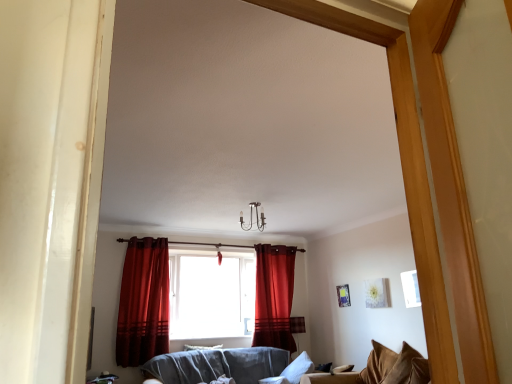
Question: From the image's perspective, is velvet gray couch at center located beneath velvet red curtain at center, which is counted as the 2th curtain, starting from the front?

Choices:
 (A) no
 (B) yes

Answer: (B)

Question: Is velvet gray couch at center further to the viewer compared to velvet red curtain at center, the first curtain when ordered from back to front?

Choices:
 (A) no
 (B) yes

Answer: (A)

Question: From the image's perspective, is velvet gray couch at center over velvet red curtain at center, which appears as the first curtain when viewed from the right?

Choices:
 (A) no
 (B) yes

Answer: (A)

Question: From a real-world perspective, is velvet gray couch at center physically below velvet red curtain at center, which is the 2th curtain in left-to-right order?

Choices:
 (A) no
 (B) yes

Answer: (B)

Question: Can you confirm if velvet gray couch at center is bigger than velvet red curtain at center, which is counted as the 2th curtain, starting from the front?

Choices:
 (A) yes
 (B) no

Answer: (A)

Question: Would you say velvet gray couch at center is outside velvet red curtain at center, the first curtain when ordered from back to front?

Choices:
 (A) yes
 (B) no

Answer: (A)

Question: From a real-world perspective, is velvet red curtain at center, the second curtain when ordered from back to front, beneath velvet gray couch at center?

Choices:
 (A) no
 (B) yes

Answer: (A)

Question: Is velvet red curtain at center, arranged as the 1th curtain when viewed from the front, further to the viewer compared to velvet gray couch at center?

Choices:
 (A) yes
 (B) no

Answer: (A)

Question: From a real-world perspective, is velvet red curtain at center, marked as the 2th curtain in a right-to-left arrangement, on velvet gray couch at center?

Choices:
 (A) yes
 (B) no

Answer: (A)

Question: Can you confirm if velvet red curtain at center, the second curtain when ordered from back to front, is bigger than velvet gray couch at center?

Choices:
 (A) no
 (B) yes

Answer: (A)

Question: Does velvet red curtain at center, arranged as the 1th curtain when viewed from the front, have a greater height compared to velvet gray couch at center?

Choices:
 (A) yes
 (B) no

Answer: (A)

Question: Can you confirm if velvet red curtain at center, marked as the 2th curtain in a right-to-left arrangement, is thinner than velvet gray couch at center?

Choices:
 (A) no
 (B) yes

Answer: (B)

Question: Does velvet red curtain at center, which is the 2th curtain in left-to-right order, appear on the left side of velvet brown pillow at lower right, the 2th pillow positioned from the left?

Choices:
 (A) no
 (B) yes

Answer: (B)